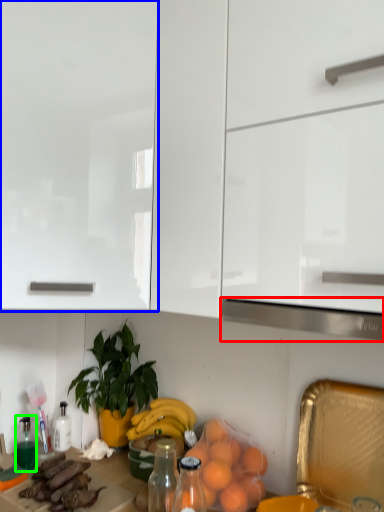
Question: Considering the real-world distances, which object is farthest from exhaust hood (highlighted by a red box)? cabinetry (highlighted by a blue box) or bottle (highlighted by a green box)?

Choices:
 (A) cabinetry
 (B) bottle

Answer: (B)